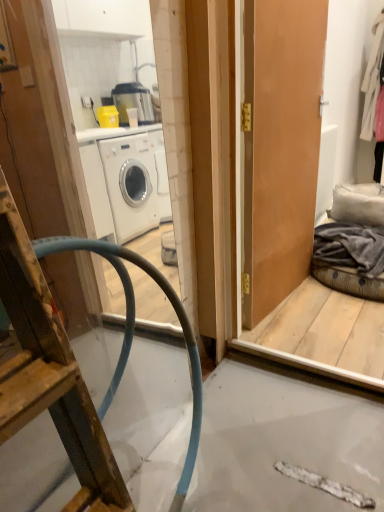
Image resolution: width=384 pixels, height=512 pixels. Describe the element at coordinates (280, 146) in the screenshot. I see `matte brown door at center` at that location.

Where is `white wool coat at upper right, which is the second clothing in bottom-to-top order`? The width and height of the screenshot is (384, 512). white wool coat at upper right, which is the second clothing in bottom-to-top order is located at coordinates (372, 78).

Between white textured radiator at right and blue rubber hose at left, which one is positioned in front?

blue rubber hose at left is closer to the camera.

Who is smaller, white textured radiator at right or blue rubber hose at left?

white textured radiator at right is smaller.

From a real-world perspective, is white textured radiator at right located higher than blue rubber hose at left?

Yes, from a real-world perspective, white textured radiator at right is on top of blue rubber hose at left.

Considering the points (101, 255) and (350, 248), which point is behind, point (101, 255) or point (350, 248)?

The point (350, 248) is farther.

Consider the image. Is blue rubber hose at left with gray cotton blanket at right, which appears as the first clothing when viewed from the left?

No, blue rubber hose at left is not touching gray cotton blanket at right, which appears as the first clothing when viewed from the left.

Is blue rubber hose at left further to the viewer compared to gray cotton blanket at right, which is counted as the second clothing, starting from the top?

No, it is not.

Is gray cotton blanket at right, which appears as the first clothing when viewed from the left, surrounded by white textured radiator at right?

No, gray cotton blanket at right, which appears as the first clothing when viewed from the left, is located outside of white textured radiator at right.

Between white textured radiator at right and gray cotton blanket at right, the 2th clothing viewed from the back, which one has less height?

With less height is gray cotton blanket at right, the 2th clothing viewed from the back.

Could you tell me if white textured radiator at right is turned towards gray cotton blanket at right, which is the 1th clothing from front to back?

No.

From the image's perspective, is matte brown door at center located beneath white wool coat at upper right, the 1th clothing from the back?

Yes, from the image's perspective, matte brown door at center is beneath white wool coat at upper right, the 1th clothing from the back.

What's the angular difference between matte brown door at center and white wool coat at upper right, which is the first clothing in right-to-left order,'s facing directions?

There is a 3.53-degree angle between the facing directions of matte brown door at center and white wool coat at upper right, which is the first clothing in right-to-left order.

Who is taller, matte brown door at center or white wool coat at upper right, the 1th clothing from the top?

matte brown door at center.

In the scene shown: Is matte brown door at center aimed at white wool coat at upper right, the second clothing in the left-to-right sequence?

No, matte brown door at center is not oriented towards white wool coat at upper right, the second clothing in the left-to-right sequence.

Who is bigger, gray cotton blanket at right, which is counted as the 1th clothing, starting from the bottom, or matte brown door at center?

matte brown door at center is bigger.

Is gray cotton blanket at right, the 2th clothing viewed from the back, turned away from matte brown door at center?

gray cotton blanket at right, the 2th clothing viewed from the back, does not have its back to matte brown door at center.

I want to click on door located in front of the gray cotton blanket at right, which is counted as the second clothing, starting from the top, so click(x=280, y=146).

Is gray cotton blanket at right, the 2th clothing in the right-to-left sequence, thinner than matte brown door at center?

No.

How different are the orientations of white textured radiator at right and matte brown door at center in degrees?

The angular difference between white textured radiator at right and matte brown door at center is 9.52 degrees.

From the image's perspective, is white textured radiator at right located beneath matte brown door at center?

Actually, white textured radiator at right appears above matte brown door at center in the image.

Consider the image. Who is bigger, white textured radiator at right or matte brown door at center?

Bigger between the two is matte brown door at center.

Looking at this image, which of these two, white textured radiator at right or matte brown door at center, stands taller?

With more height is matte brown door at center.

Is point (128, 352) closer or farther from the camera than point (298, 99)?

Clearly, point (128, 352) is closer to the camera than point (298, 99).

This screenshot has height=512, width=384. In order to click on garden hose on the left side of matte brown door at center in this screenshot , I will do `click(134, 329)`.

Between blue rubber hose at left and matte brown door at center, which one has more height?

matte brown door at center is taller.

Choose the correct answer: Is blue rubber hose at left inside matte brown door at center or outside it?

blue rubber hose at left is located beyond the bounds of matte brown door at center.

This screenshot has width=384, height=512. What are the coordinates of `garden hose on the left of white textured radiator at right` in the screenshot? It's located at (134, 329).

Image resolution: width=384 pixels, height=512 pixels. In order to click on garden hose in front of the gray cotton blanket at right, which appears as the first clothing when viewed from the left in this screenshot , I will do `click(134, 329)`.

Considering their positions, is blue rubber hose at left positioned further to white textured radiator at right than matte brown door at center?

blue rubber hose at left lies further to white textured radiator at right than the other object.

Which object lies further to the anchor point white wool coat at upper right, the 1th clothing from the top, gray cotton blanket at right, the 2th clothing viewed from the back, or white textured radiator at right?

gray cotton blanket at right, the 2th clothing viewed from the back, is further to white wool coat at upper right, the 1th clothing from the top.

Based on the photo, considering their positions, is white textured radiator at right positioned further to matte brown door at center than blue rubber hose at left?

white textured radiator at right is positioned further to the anchor matte brown door at center.

When comparing their distances from white wool coat at upper right, arranged as the 2th clothing when viewed from the front, does blue rubber hose at left or white textured radiator at right seem closer?

white textured radiator at right is closer to white wool coat at upper right, arranged as the 2th clothing when viewed from the front.

Which object lies nearer to the anchor point blue rubber hose at left, gray cotton blanket at right, the 2th clothing viewed from the back, or white textured radiator at right?

gray cotton blanket at right, the 2th clothing viewed from the back, lies closer to blue rubber hose at left than the other object.

Based on their spatial positions, is matte brown door at center or gray cotton blanket at right, which is counted as the 1th clothing, starting from the bottom, closer to blue rubber hose at left?

The object closer to blue rubber hose at left is matte brown door at center.

From the image, which object appears to be farther from white textured radiator at right, matte brown door at center or gray cotton blanket at right, the 2th clothing viewed from the back?

matte brown door at center is positioned further to the anchor white textured radiator at right.

Which object lies nearer to the anchor point white wool coat at upper right, the second clothing in the left-to-right sequence, matte brown door at center or blue rubber hose at left?

matte brown door at center is closer to white wool coat at upper right, the second clothing in the left-to-right sequence.

Where is `clothing between matte brown door at center and white textured radiator at right in the front-back direction`? clothing between matte brown door at center and white textured radiator at right in the front-back direction is located at coordinates (349, 247).

The width and height of the screenshot is (384, 512). Find the location of `door located between blue rubber hose at left and gray cotton blanket at right, which is counted as the 1th clothing, starting from the bottom, in the depth direction`. door located between blue rubber hose at left and gray cotton blanket at right, which is counted as the 1th clothing, starting from the bottom, in the depth direction is located at coordinates (280, 146).

In order to click on clothing between matte brown door at center and white wool coat at upper right, which is the first clothing in right-to-left order, in the front-back direction in this screenshot , I will do `click(349, 247)`.

Identify the location of door located between blue rubber hose at left and white textured radiator at right in the depth direction. This screenshot has height=512, width=384. point(280,146).